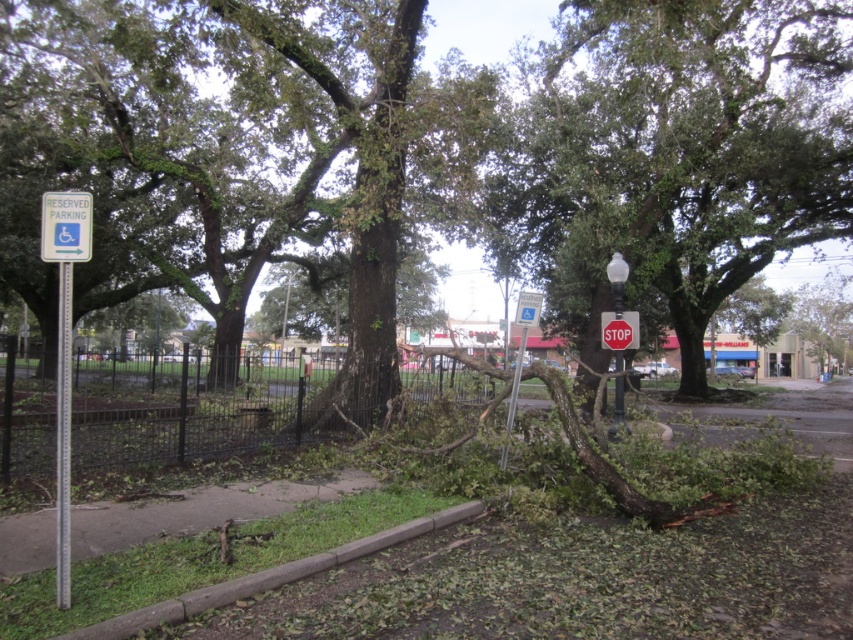
Question: Can you confirm if metallic pole at center is positioned to the right of metallic silver handicap parking sign at center?

Choices:
 (A) yes
 (B) no

Answer: (A)

Question: Which object is farther from the camera taking this photo?

Choices:
 (A) metallic silver parking sign at center
 (B) metallic silver pole at left
 (C) metallic silver handicap parking sign at center
 (D) green plastic reserved parking sign at upper left

Answer: (C)

Question: Considering the real-world distances, which object is farthest from the red matte stop sign at center?

Choices:
 (A) metallic silver parking sign at center
 (B) metallic silver handicap parking sign at center

Answer: (B)

Question: Considering the relative positions of metallic pole at center and metallic silver handicap parking sign at center in the image provided, where is metallic pole at center located with respect to metallic silver handicap parking sign at center?

Choices:
 (A) right
 (B) left

Answer: (A)

Question: Can you confirm if green plastic reserved parking sign at upper left is wider than red matte stop sign at center?

Choices:
 (A) yes
 (B) no

Answer: (B)

Question: Which point is farther from the camera taking this photo?

Choices:
 (A) (502, 451)
 (B) (618, 352)
 (C) (741, 260)
 (D) (74, 225)

Answer: (C)